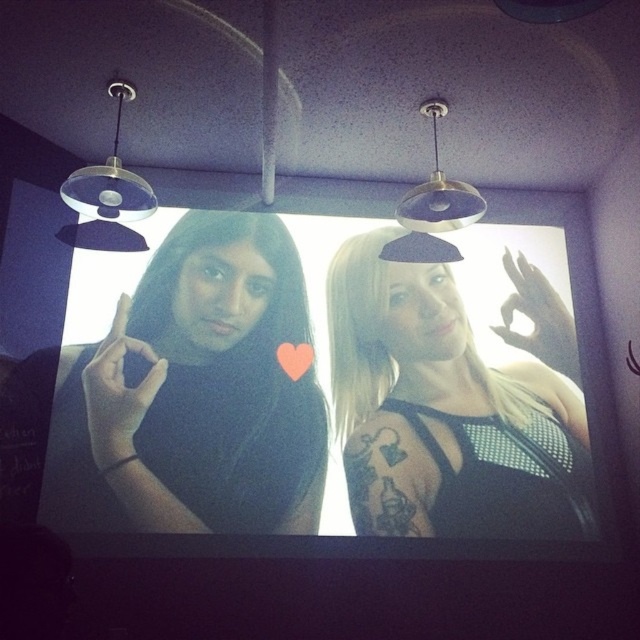
Question: Can you confirm if black matte shirt at left is bigger than black mesh top at center?

Choices:
 (A) yes
 (B) no

Answer: (A)

Question: Is black matte shirt at left wider than black mesh top at center?

Choices:
 (A) no
 (B) yes

Answer: (A)

Question: In this image, where is black matte shirt at left located relative to black mesh top at center?

Choices:
 (A) right
 (B) left

Answer: (B)